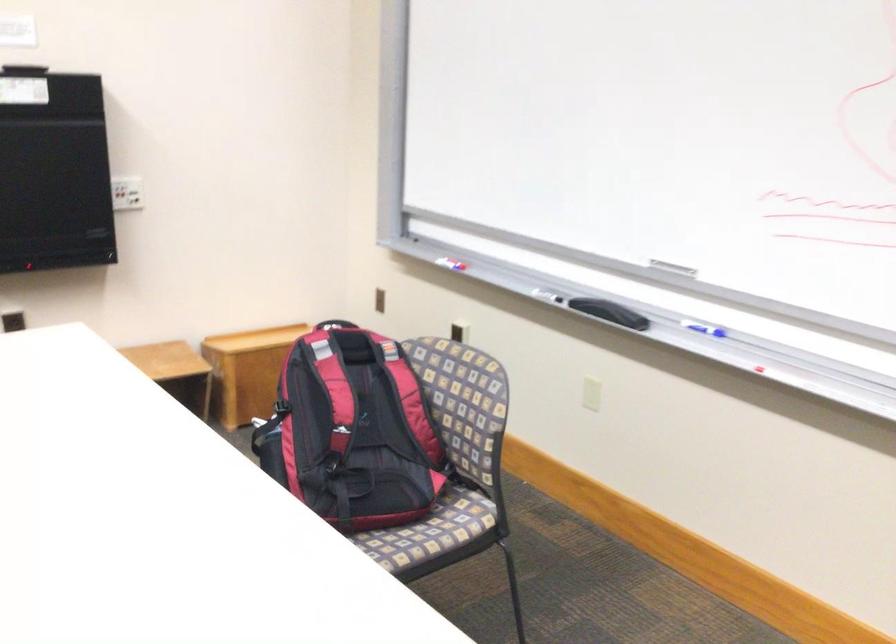
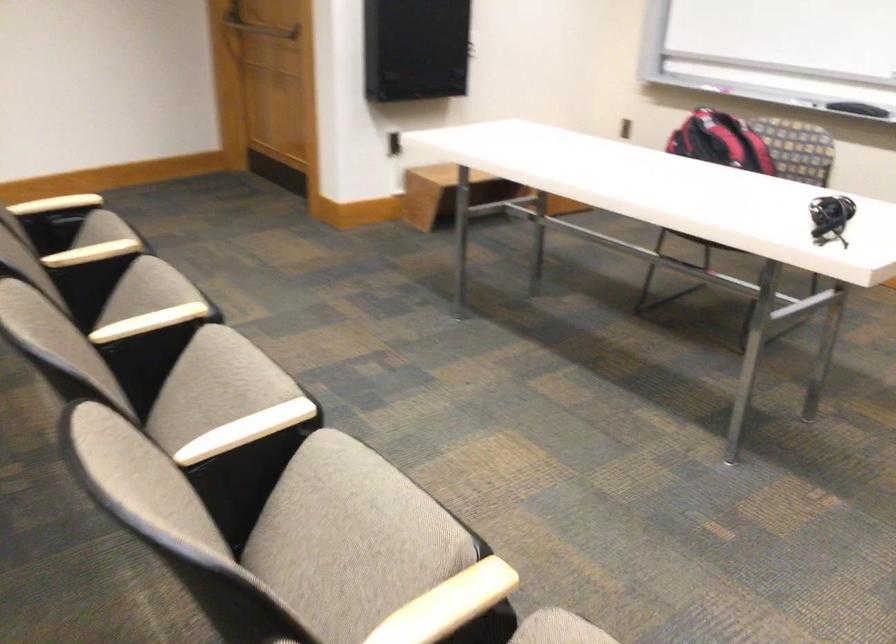
Question: I am providing you with two images of the same scene from different viewpoints. Please identify which objects are invisible in image2.

Choices:
 (A) patterned round canister
 (B) chair sitting surface
 (C) black whiteboard eraser
 (D) red and black backpack

Answer: (B)